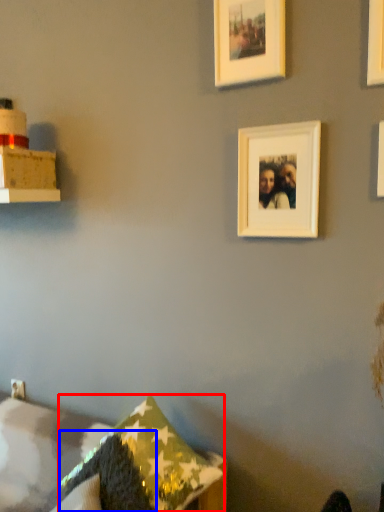
Question: Which object appears closest to the camera in this image, pillow (highlighted by a red box) or pillow (highlighted by a blue box)?

Choices:
 (A) pillow
 (B) pillow

Answer: (B)